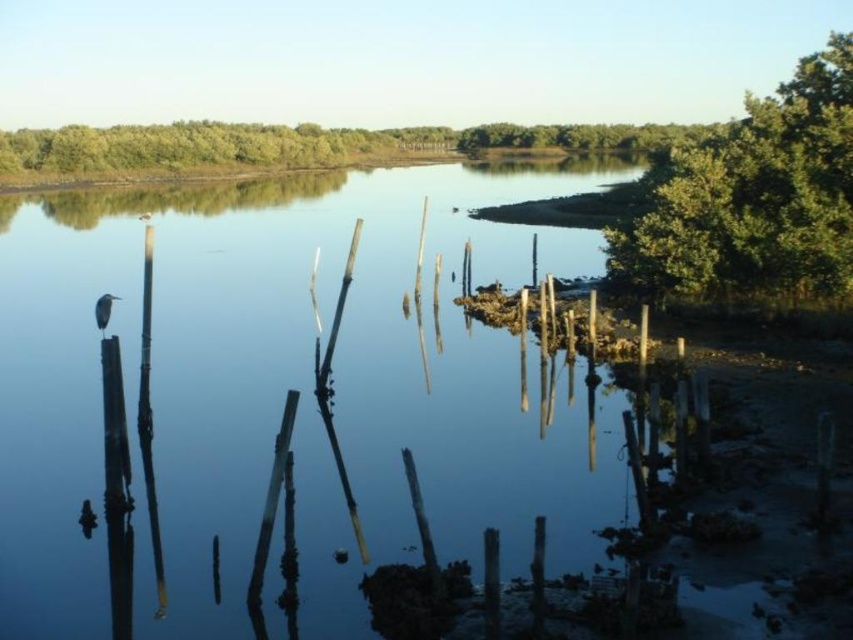
Question: Can you confirm if smooth water at center is positioned above green leafy tree at upper right?

Choices:
 (A) no
 (B) yes

Answer: (A)

Question: Does smooth water at center appear under green leafy tree at upper right?

Choices:
 (A) no
 (B) yes

Answer: (B)

Question: Can you confirm if smooth water at center is positioned to the right of green leafy tree at upper right?

Choices:
 (A) no
 (B) yes

Answer: (A)